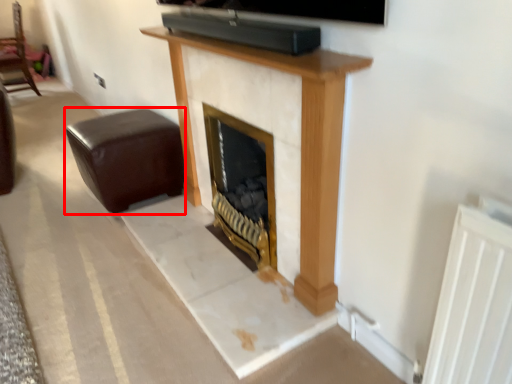
Question: From the image, what is the correct spatial relationship of furniture (annotated by the red box) in relation to furniture?

Choices:
 (A) left
 (B) right

Answer: (B)